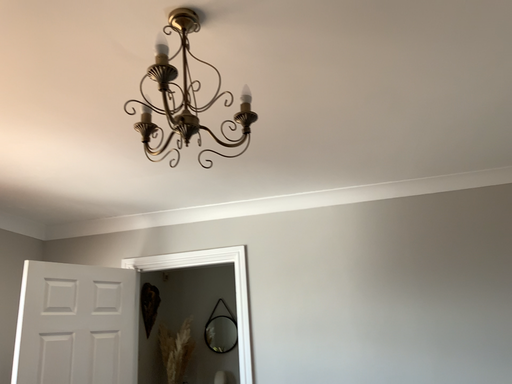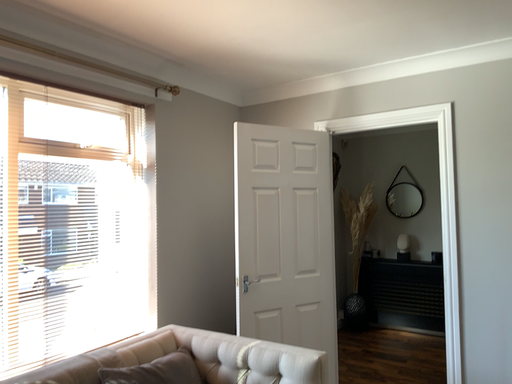
Question: Which way did the camera rotate in the video?

Choices:
 (A) rotated upward
 (B) rotated downward

Answer: (B)